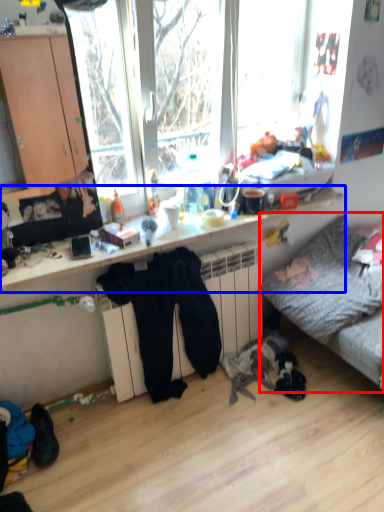
Question: Which of the following is the closest to the observer, studio couch (highlighted by a red box) or desk (highlighted by a blue box)?

Choices:
 (A) studio couch
 (B) desk

Answer: (B)